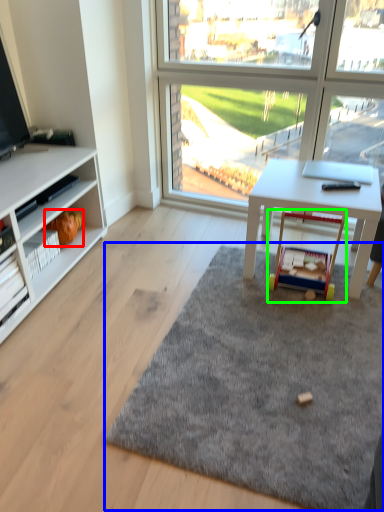
Question: Estimate the real-world distances between objects in this image. Which object is farther from toy (highlighted by a red box), mat (highlighted by a blue box) or toy (highlighted by a green box)?

Choices:
 (A) mat
 (B) toy

Answer: (A)